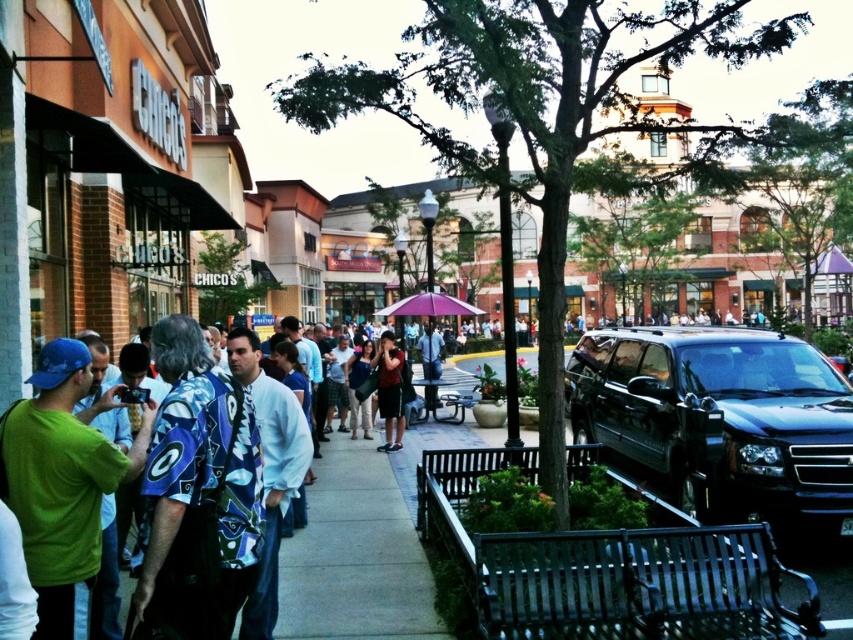
Who is positioned more to the right, dark blue shirt at center or purple fabric umbrella at center?

From the viewer's perspective, purple fabric umbrella at center appears more on the right side.

Between point (389, 396) and point (445, 307), which one is positioned behind?

The point (445, 307) is more distant.

You are a GUI agent. You are given a task and a screenshot of the screen. Output one action in this format:
    pyautogui.click(x=<x>, y=<y>)
    Task: Click on the dark blue shirt at center
    
    Given the screenshot: What is the action you would take?
    pyautogui.click(x=389, y=388)

The width and height of the screenshot is (853, 640). What do you see at coordinates (720, 420) in the screenshot? I see `shiny black suv at center` at bounding box center [720, 420].

Between shiny black suv at center and dark blue shirt at center, which one is positioned lower?

dark blue shirt at center

The width and height of the screenshot is (853, 640). I want to click on shiny black suv at center, so click(x=720, y=420).

The height and width of the screenshot is (640, 853). What are the coordinates of `shiny black suv at center` in the screenshot? It's located at (720, 420).

Does shiny black suv at center appear over purple fabric umbrella at center?

Actually, shiny black suv at center is below purple fabric umbrella at center.

This screenshot has height=640, width=853. What do you see at coordinates (720, 420) in the screenshot? I see `shiny black suv at center` at bounding box center [720, 420].

The height and width of the screenshot is (640, 853). Describe the element at coordinates (720, 420) in the screenshot. I see `shiny black suv at center` at that location.

At what (x,y) coordinates should I click in order to perform the action: click on shiny black suv at center. Please return your answer as a coordinate pair (x, y). Looking at the image, I should click on (720, 420).